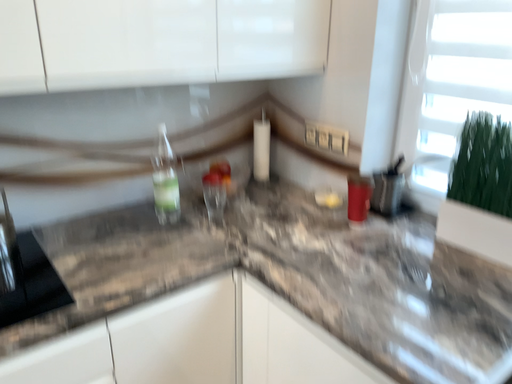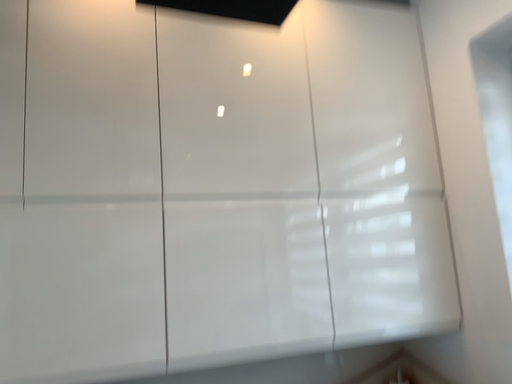
Question: Which way did the camera rotate in the video?

Choices:
 (A) rotated upward
 (B) rotated downward

Answer: (A)